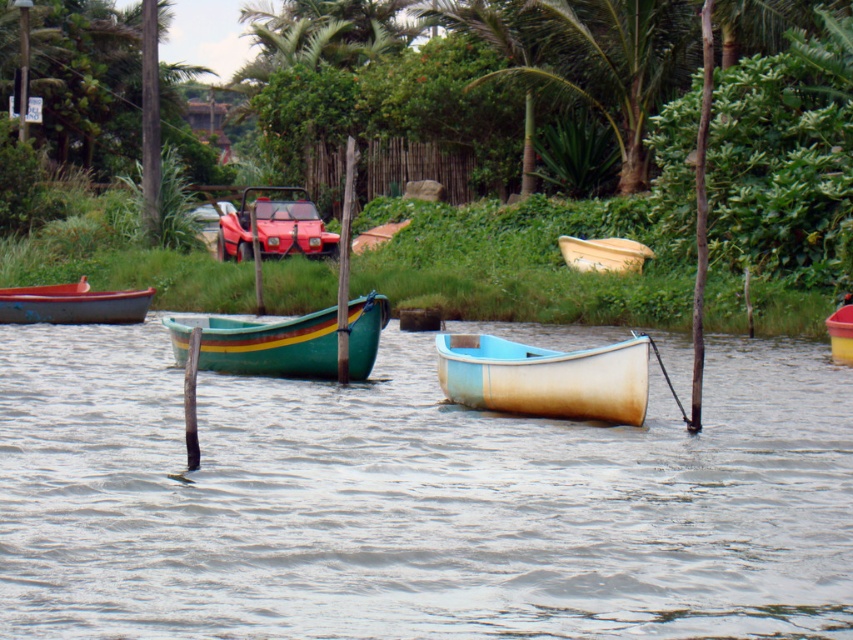
Does clear water at center appear over matte yellow boat at center?

Actually, clear water at center is below matte yellow boat at center.

Is point (38, 538) positioned before point (610, 253)?

Yes, point (38, 538) is in front of point (610, 253).

Who is more forward, (119, 484) or (595, 260)?

Positioned in front is point (119, 484).

Where is `clear water at center`? Image resolution: width=853 pixels, height=640 pixels. clear water at center is located at coordinates (415, 500).

Who is lower down, green painted wood canoe at center or matte yellow boat at center?

green painted wood canoe at center is lower down.

Between point (289, 355) and point (579, 262), which one is positioned in front?

Point (289, 355) is in front.

Find the location of `green painted wood canoe at center`. green painted wood canoe at center is located at coordinates (260, 344).

Is light blue wooden canoe at center wider than matte yellow boat at center?

Indeed, light blue wooden canoe at center has a greater width compared to matte yellow boat at center.

Which of these two, light blue wooden canoe at center or matte yellow boat at center, stands shorter?

With less height is matte yellow boat at center.

Find the location of a particular element. This screenshot has width=853, height=640. light blue wooden canoe at center is located at coordinates (544, 378).